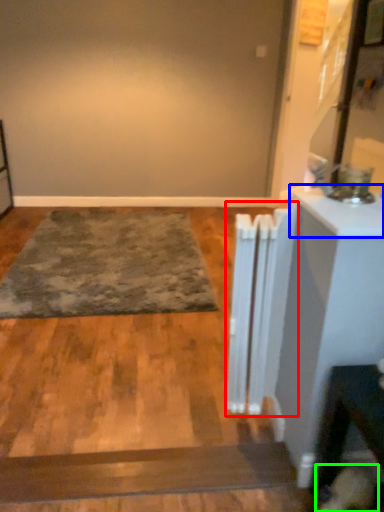
Question: Considering the real-world distances, which object is farthest from radiator (highlighted by a red box)? counter top (highlighted by a blue box) or dog (highlighted by a green box)?

Choices:
 (A) counter top
 (B) dog

Answer: (B)